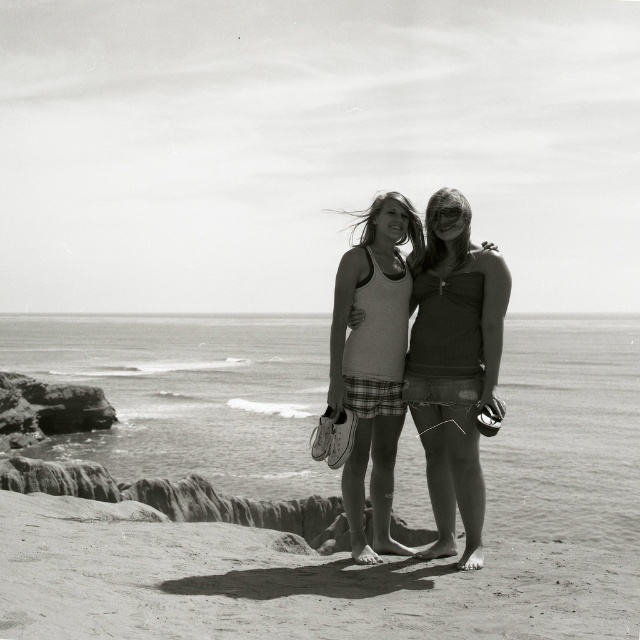
Is point (33, 628) farther from camera compared to point (426, 464)?

No, it is not.

Is smooth sand at lower center bigger than matte white tank top at center?

Indeed, smooth sand at lower center has a larger size compared to matte white tank top at center.

The height and width of the screenshot is (640, 640). Find the location of `smooth sand at lower center`. smooth sand at lower center is located at coordinates (282, 582).